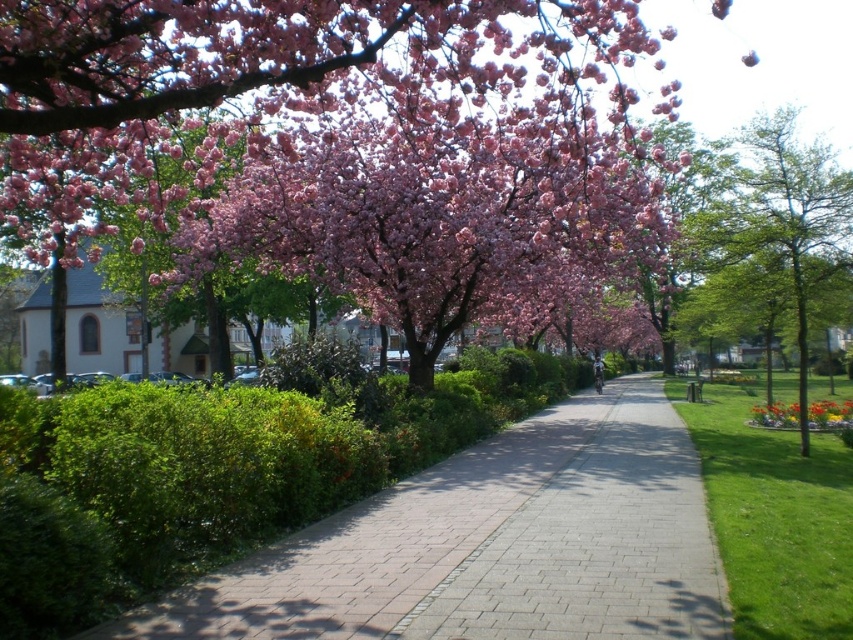
You are a photographer standing at the lower right corner of the park scene. You want to take a photo that includes both the pink blossoms at upper center and the vibrant yellow flower at lower right. Given that your camera has a maximum zoom range of 10 meters, will you be able to capture both subjects in a single frame without moving your position?

The pink blossoms at upper center and vibrant yellow flower at lower right are 19.17 meters apart. Since the camera can only zoom up to 10 meters, you won the be able to capture both subjects in a single frame without moving your position.

You are standing at the camera position and want to reach the point marked as point (834,180). If you walk in a straight line towards it, how far will you have to walk?

You will have to walk 46.28 feet to reach the point marked as point (834,180) from the camera position.

You are a gardener planning to trim both the pink blossoms at upper center and the green leafy tree at right. Based on their heights, which one requires a ladder for safe trimming?

The green leafy tree at right requires a ladder for safe trimming since it is taller than the pink blossoms at upper center.